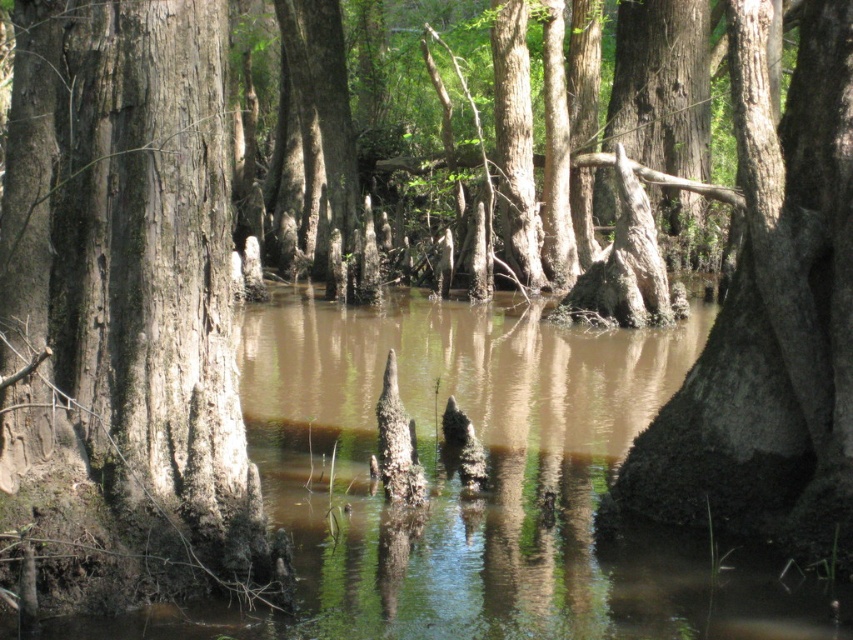
Between point (10, 564) and point (817, 44), which one is positioned behind?

The point (817, 44) is more distant.

Find the location of `smooth bark tree at center`. smooth bark tree at center is located at coordinates (125, 314).

Find the location of a particular element. smooth bark tree at center is located at coordinates (125, 314).

Locate an element on the screen. smooth bark tree at center is located at coordinates (125, 314).

Is point (22, 148) in front of point (619, 577)?

That is True.

What are the coordinates of `smooth bark tree at center` in the screenshot? It's located at (125, 314).

Is point (502, 525) closer to camera compared to point (759, 426)?

That is False.

Is point (300, 381) farther from viewer compared to point (746, 404)?

Yes, it is.

Where is `brown muddy water at center`? This screenshot has height=640, width=853. brown muddy water at center is located at coordinates (480, 492).

Locate an element on the screen. brown muddy water at center is located at coordinates (480, 492).